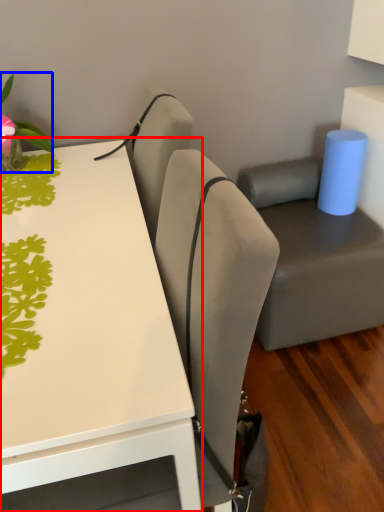
Question: Which point is further to the camera, table (highlighted by a red box) or plant (highlighted by a blue box)?

Choices:
 (A) table
 (B) plant

Answer: (B)